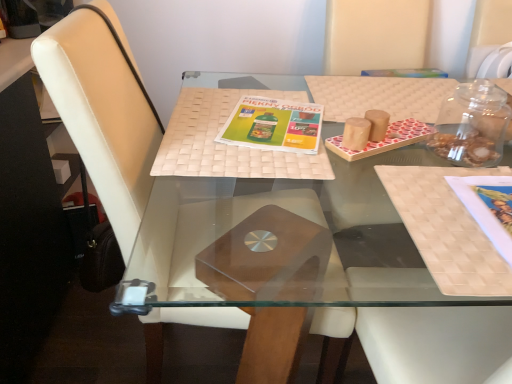
Identify the location of vacant area on the back side of green matte magazine at center, arranged as the second book cover when viewed from the front. The image size is (512, 384). (280, 96).